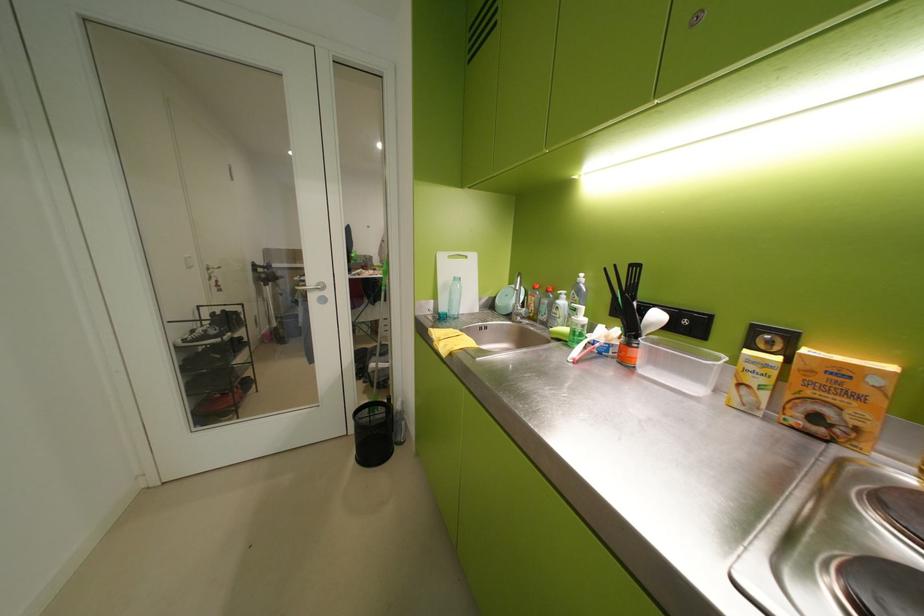
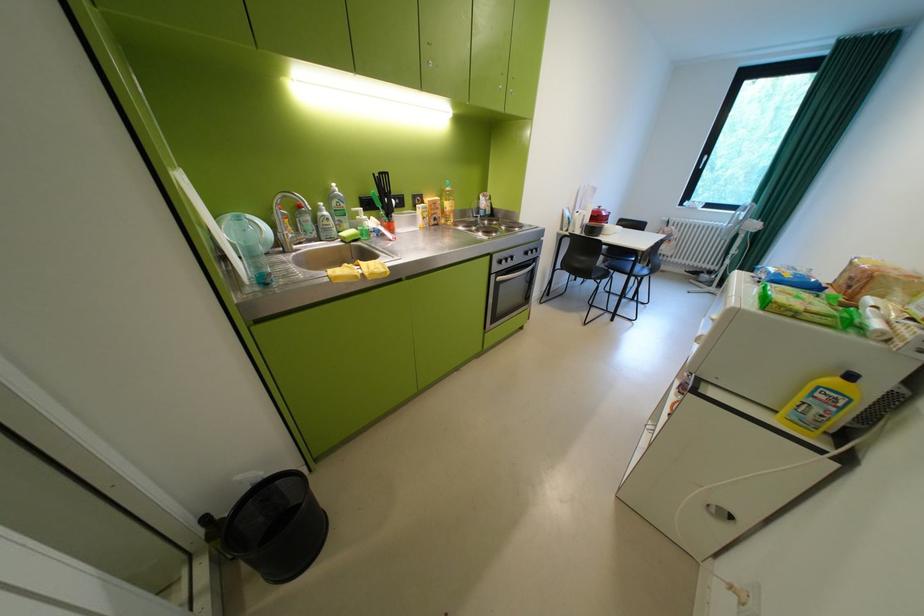
Find the pixel in the second image that matches [567,309] in the first image.

(338, 220)